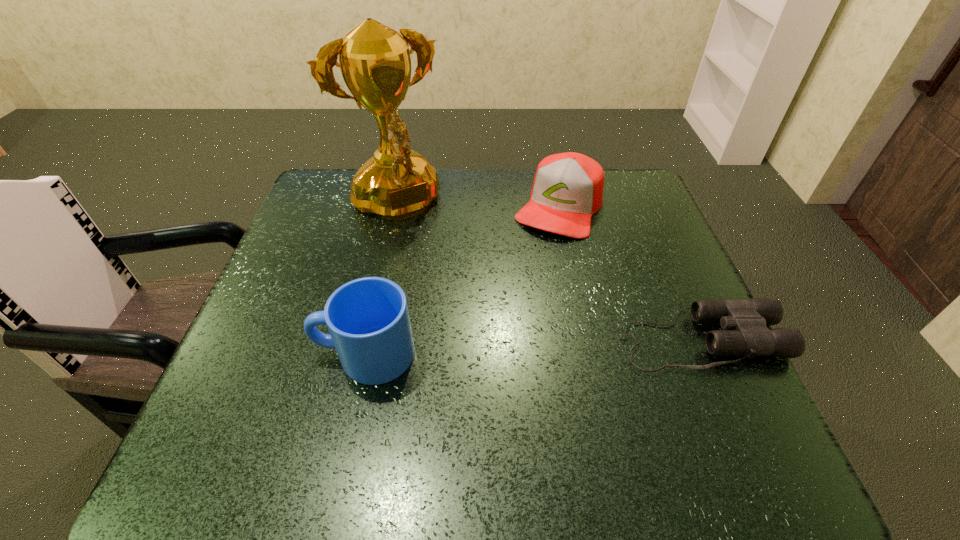
I want to click on vacant space in between the baseball cap and the shortest object, so click(x=630, y=273).

Image resolution: width=960 pixels, height=540 pixels. Identify the location of free space that is in between the binoculars and the tallest object. (547, 274).

Find the location of `free area in between the binoculars and the baseball cap`. free area in between the binoculars and the baseball cap is located at coordinates (630, 273).

What are the coordinates of `empty space between the award and the baseball cap` in the screenshot? It's located at (477, 207).

At what (x,y) coordinates should I click in order to perform the action: click on empty location between the award and the shortest object. Please return your answer as a coordinate pair (x, y). This screenshot has height=540, width=960. Looking at the image, I should click on (547, 274).

Locate which object is the third closest to the baseball cap. Please provide its 2D coordinates. Your answer should be formatted as a tuple, i.e. [(x, y)], where the tuple contains the x and y coordinates of a point satisfying the conditions above.

[(368, 320)]

Select which object is the third closest to the mug. Please provide its 2D coordinates. Your answer should be formatted as a tuple, i.e. [(x, y)], where the tuple contains the x and y coordinates of a point satisfying the conditions above.

[(745, 322)]

Find the location of a particular element. Image resolution: width=960 pixels, height=540 pixels. free space that satisfies the following two spatial constraints: 1. on the front side of the shortest object; 2. at the eyepiece of the award is located at coordinates tap(366, 340).